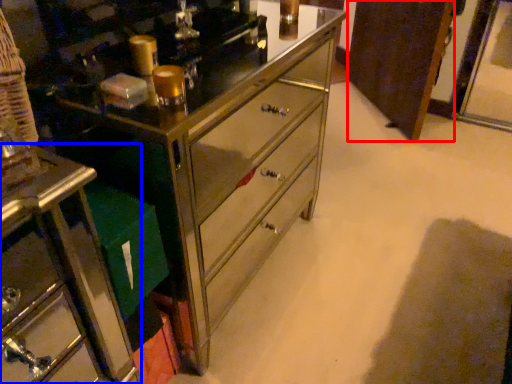
Question: Among these objects, which one is nearest to the camera, cabinetry (highlighted by a red box) or furniture (highlighted by a blue box)?

Choices:
 (A) cabinetry
 (B) furniture

Answer: (B)